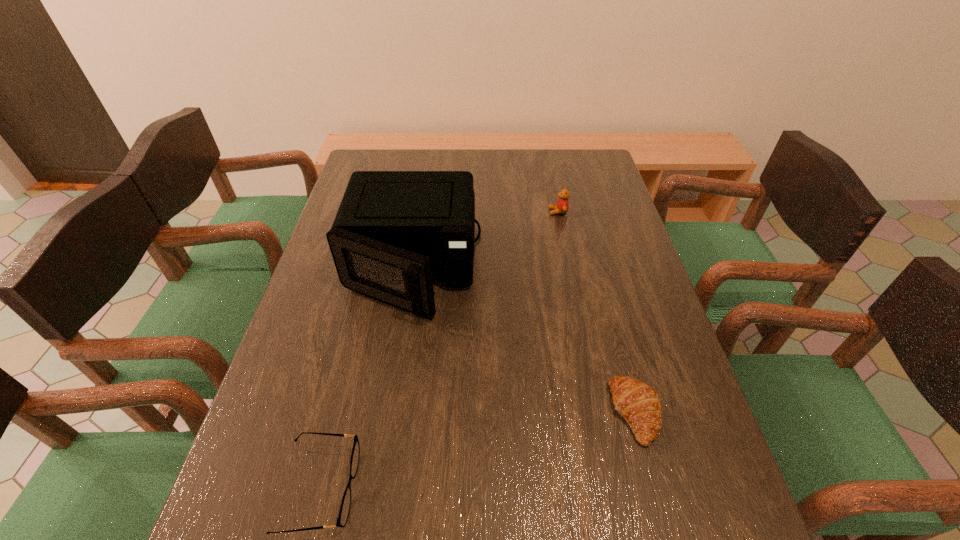
In order to click on vacant space at the far edge of the desktop in this screenshot , I will do `click(424, 168)`.

You are a GUI agent. You are given a task and a screenshot of the screen. Output one action in this format:
    pyautogui.click(x=<x>, y=<y>)
    Task: Click on the free spot at the left edge of the desktop
    The width and height of the screenshot is (960, 540).
    Given the screenshot: What is the action you would take?
    pyautogui.click(x=357, y=314)

Locate an element on the screen. The height and width of the screenshot is (540, 960). vacant space at the right edge of the desktop is located at coordinates (639, 326).

Locate an element on the screen. The height and width of the screenshot is (540, 960). free area in between the teddy bear and the microwave oven is located at coordinates (480, 239).

Image resolution: width=960 pixels, height=540 pixels. What are the coordinates of `unoccupied area between the third shortest object and the tallest object` in the screenshot? It's located at (480, 239).

Where is `vacant area that lies between the crescent roll and the third shortest object`? This screenshot has height=540, width=960. vacant area that lies between the crescent roll and the third shortest object is located at coordinates (596, 312).

You are a GUI agent. You are given a task and a screenshot of the screen. Output one action in this format:
    pyautogui.click(x=<x>, y=<y>)
    Task: Click on the vacant space in between the third shortest object and the crescent roll
    The width and height of the screenshot is (960, 540).
    Given the screenshot: What is the action you would take?
    pyautogui.click(x=596, y=312)

I want to click on free spot between the microwave oven and the second tallest object, so [480, 239].

Choose which object is the nearest neighbor to the crescent roll. Please provide its 2D coordinates. Your answer should be formatted as a tuple, i.e. [(x, y)], where the tuple contains the x and y coordinates of a point satisfying the conditions above.

[(395, 232)]

Identify which object is the closest to the shortest object. Please provide its 2D coordinates. Your answer should be formatted as a tuple, i.e. [(x, y)], where the tuple contains the x and y coordinates of a point satisfying the conditions above.

[(395, 232)]